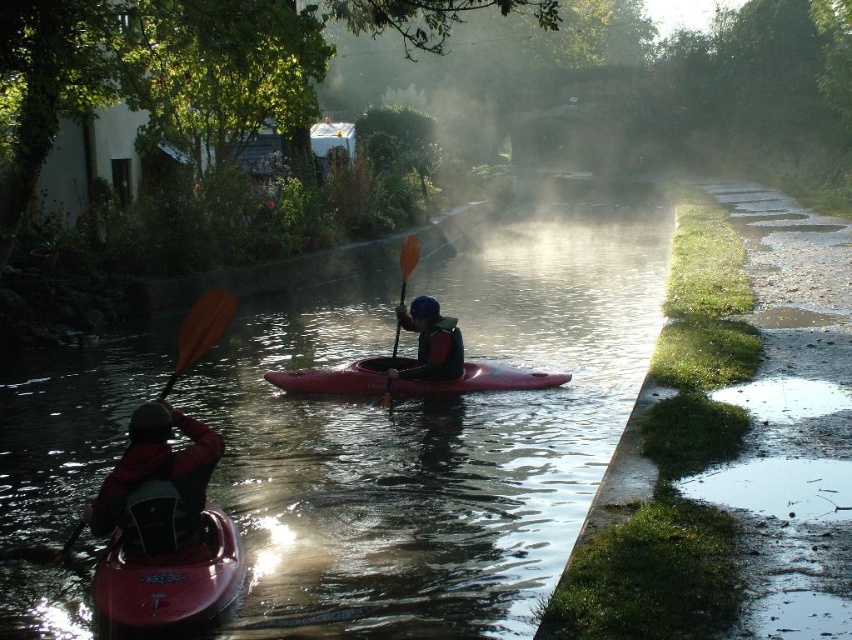
Question: Which is nearer to the matte black kayak at left?

Choices:
 (A) matte red kayak at center
 (B) matte black kayak at center
 (C) orange paddle at center
 (D) smooth plastic water at center

Answer: (B)

Question: Is matte black kayak at left to the right of matte red kayak at center from the viewer's perspective?

Choices:
 (A) no
 (B) yes

Answer: (A)

Question: Does smooth plastic water at center appear over matte black kayak at center?

Choices:
 (A) no
 (B) yes

Answer: (B)

Question: Among these objects, which one is farthest from the camera?

Choices:
 (A) matte red kayak at center
 (B) orange paddle at center

Answer: (A)

Question: Is smooth plastic water at center to the right of orange paddle at center from the viewer's perspective?

Choices:
 (A) no
 (B) yes

Answer: (B)

Question: Which of the following is the closest to the observer?

Choices:
 (A) (160, 461)
 (B) (514, 579)
 (C) (93, 595)

Answer: (A)